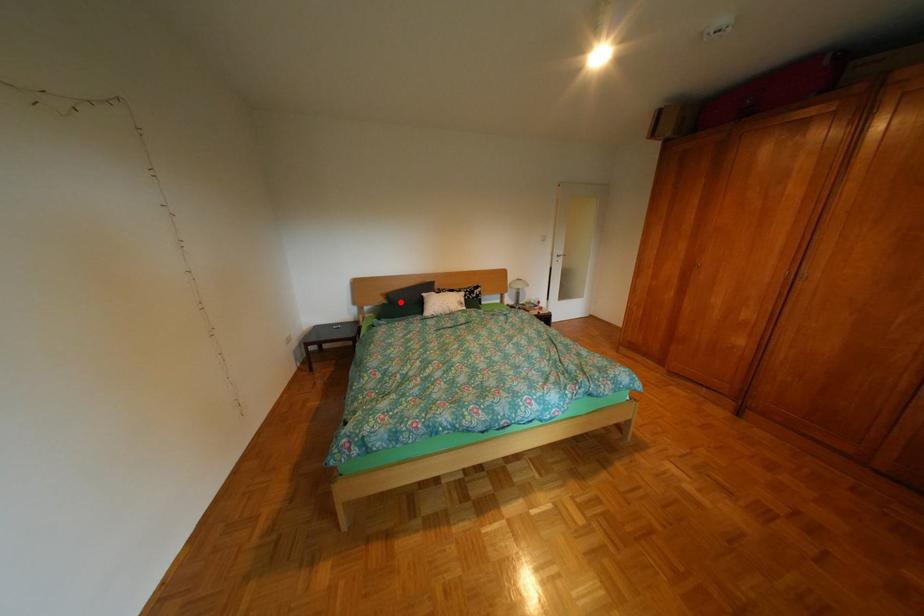
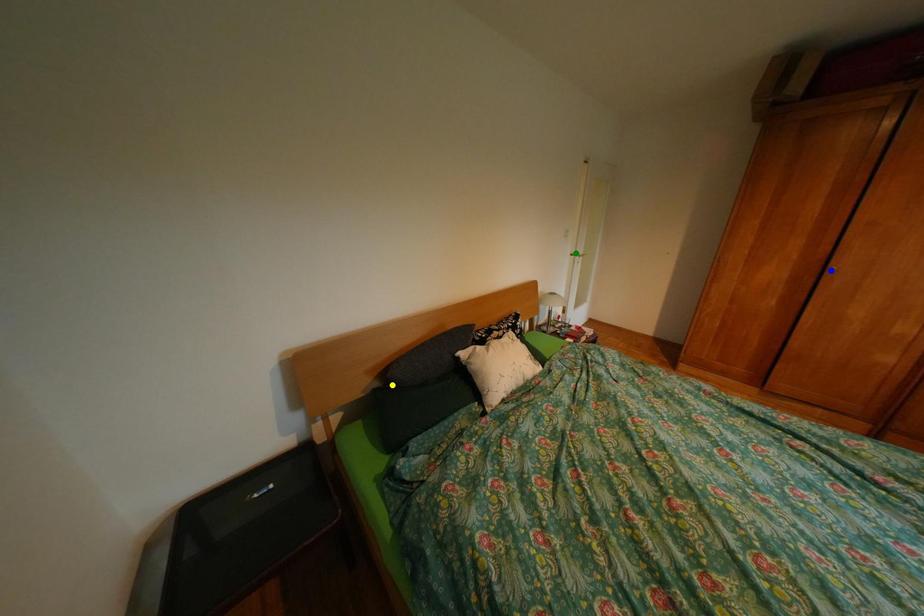
Question: I am providing you with two images of the same scene from different viewpoints. A red point is marked on the first image. You are given multiple points on the second image. Which point in image 2 is actually the same real-world point as the red point in image 1?

Choices:
 (A) green point
 (B) blue point
 (C) yellow point

Answer: (C)